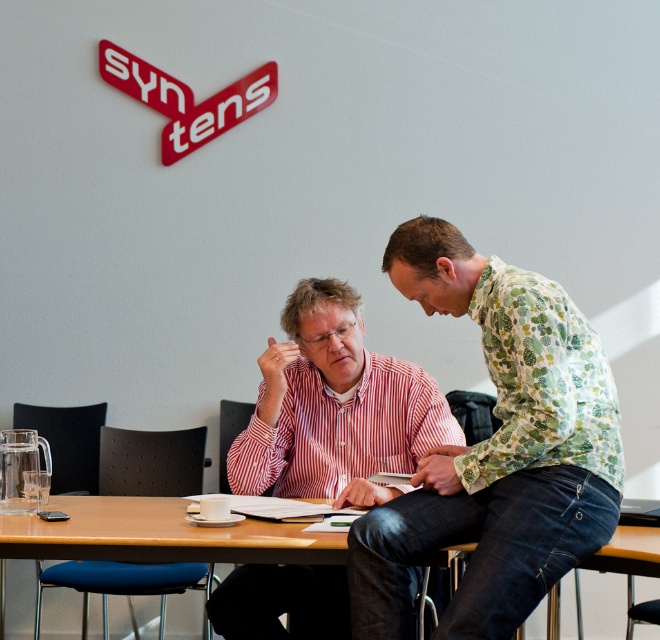
Question: Is striped cotton shirt at center closer to the viewer compared to brown wooden table at center?

Choices:
 (A) yes
 (B) no

Answer: (B)

Question: Among these points, which one is farthest from the camera?

Choices:
 (A) (339, 292)
 (B) (403, 556)
 (C) (234, 534)

Answer: (A)

Question: Which object appears closest to the camera in this image?

Choices:
 (A) brown wooden table at center
 (B) striped cotton shirt at center

Answer: (A)

Question: Can you confirm if floral-patterned shirt at center is wider than striped cotton shirt at center?

Choices:
 (A) yes
 (B) no

Answer: (B)

Question: Estimate the real-world distances between objects in this image. Which object is farther from the striped cotton shirt at center?

Choices:
 (A) floral-patterned shirt at center
 (B) brown wooden table at center

Answer: (A)

Question: Does floral-patterned shirt at center appear over striped cotton shirt at center?

Choices:
 (A) yes
 (B) no

Answer: (A)